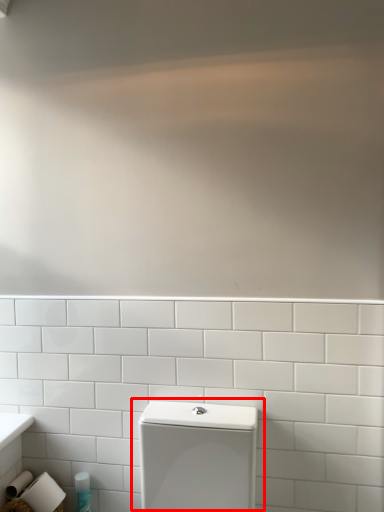
Question: In this image, where is toilet (annotated by the red box) located relative to toiletry?

Choices:
 (A) left
 (B) right

Answer: (B)